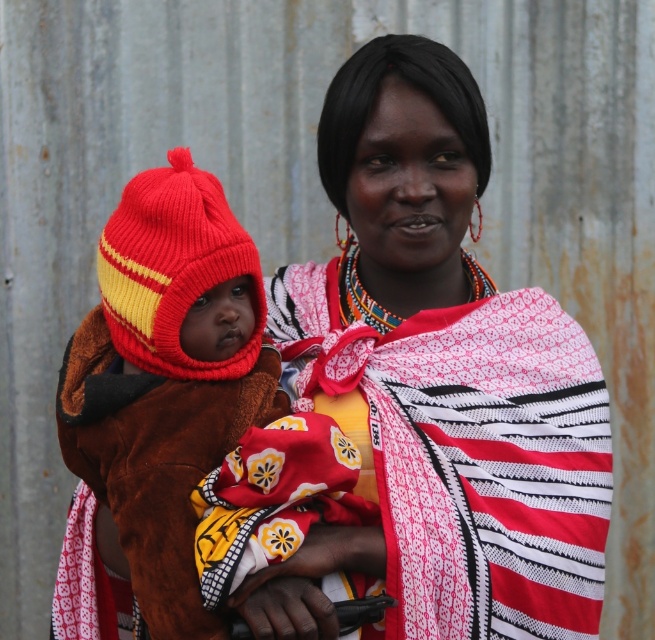
Is knitted fabric shawl at center above knitted/red/yellow hat at left?

No, knitted fabric shawl at center is not above knitted/red/yellow hat at left.

Where is `knitted fabric shawl at center`? The image size is (655, 640). knitted fabric shawl at center is located at coordinates (443, 371).

Can you confirm if knitted woolen hat at left is thinner than knitted/red/yellow hat at left?

Incorrect, knitted woolen hat at left's width is not less than knitted/red/yellow hat at left's.

Who is lower down, knitted woolen hat at left or knitted/red/yellow hat at left?

knitted woolen hat at left

Does point (107, 454) come behind point (227, 253)?

That is True.

Locate an element on the screen. This screenshot has width=655, height=640. knitted woolen hat at left is located at coordinates (166, 378).

In the scene shown: Can you confirm if knitted fabric shawl at center is wider than knitted woolen hat at left?

Correct, the width of knitted fabric shawl at center exceeds that of knitted woolen hat at left.

The image size is (655, 640). Find the location of `knitted fabric shawl at center`. knitted fabric shawl at center is located at coordinates (443, 371).